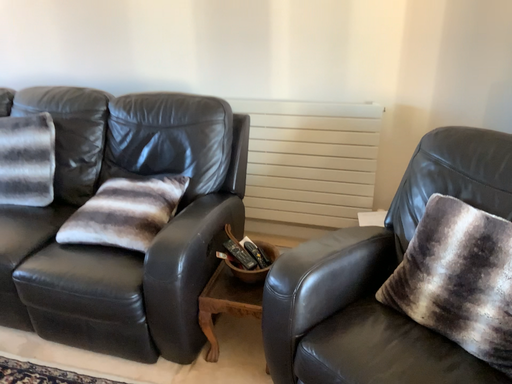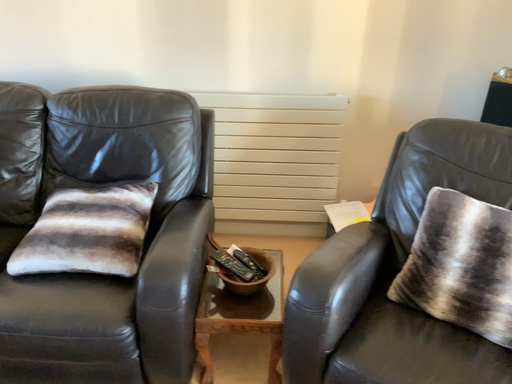
Question: How did the camera likely rotate when shooting the video?

Choices:
 (A) rotated right
 (B) rotated left

Answer: (A)